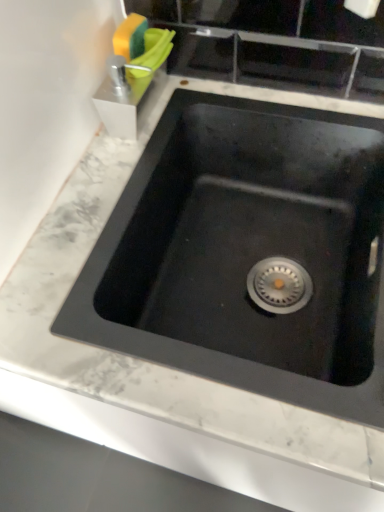
This screenshot has width=384, height=512. I want to click on black matte sink at center, so click(x=245, y=254).

What do you see at coordinates (245, 254) in the screenshot? I see `black matte sink at center` at bounding box center [245, 254].

Find the location of a particular element. This screenshot has width=384, height=512. black matte sink at center is located at coordinates (245, 254).